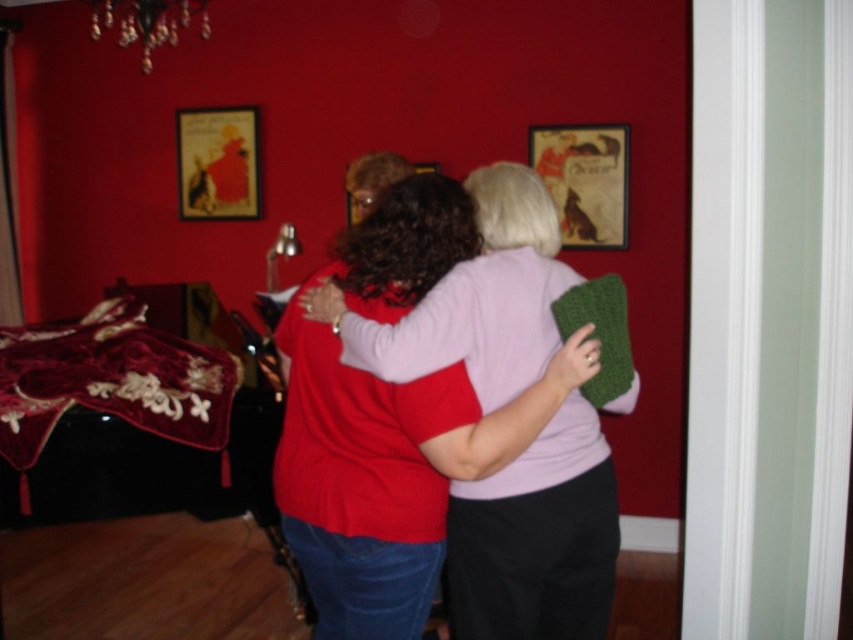
You are a photographer setting up for a group photo in this room. You need to position a 3.5 feet wide backdrop between the matte pink sweater at center and the metallic gold picture frame at upper center. Will there be enough space between them to place the backdrop?

The distance between the matte pink sweater at center and the metallic gold picture frame at upper center is 6.77 feet. Since the backdrop is 3.5 feet wide, there is sufficient space as 6.77 feet is greater than 3.5 feet.